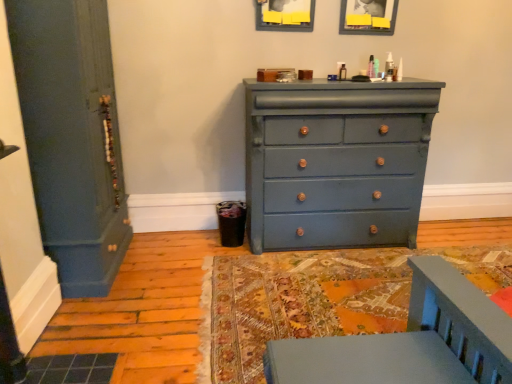
Question: Does matte blue door at left have a smaller size compared to matte gray picture frame at upper center, positioned as the second picture frame in right-to-left order?

Choices:
 (A) yes
 (B) no

Answer: (B)

Question: Is matte blue door at left at the right side of matte gray picture frame at upper center, positioned as the second picture frame in right-to-left order?

Choices:
 (A) no
 (B) yes

Answer: (A)

Question: Considering the relative sizes of matte blue door at left and matte gray picture frame at upper center, positioned as the second picture frame in right-to-left order, in the image provided, is matte blue door at left bigger than matte gray picture frame at upper center, positioned as the second picture frame in right-to-left order,?

Choices:
 (A) no
 (B) yes

Answer: (B)

Question: From the image's perspective, would you say matte blue door at left is shown under matte gray picture frame at upper center, positioned as the second picture frame in right-to-left order?

Choices:
 (A) yes
 (B) no

Answer: (A)

Question: Does matte blue door at left have a greater width compared to matte gray picture frame at upper center, acting as the first picture frame starting from the left?

Choices:
 (A) yes
 (B) no

Answer: (A)

Question: Is matte blue door at left shorter than matte gray picture frame at upper center, acting as the first picture frame starting from the left?

Choices:
 (A) yes
 (B) no

Answer: (B)

Question: Does matte blue door at left have a smaller size compared to matte blue dresser at center?

Choices:
 (A) no
 (B) yes

Answer: (A)

Question: Considering the relative sizes of matte blue door at left and matte blue dresser at center in the image provided, is matte blue door at left shorter than matte blue dresser at center?

Choices:
 (A) yes
 (B) no

Answer: (B)

Question: From the image's perspective, would you say matte blue door at left is shown under matte blue dresser at center?

Choices:
 (A) yes
 (B) no

Answer: (B)

Question: From the image's perspective, is matte blue door at left on matte blue dresser at center?

Choices:
 (A) no
 (B) yes

Answer: (B)

Question: Is matte blue door at left looking in the opposite direction of matte blue dresser at center?

Choices:
 (A) yes
 (B) no

Answer: (B)

Question: Can you confirm if matte blue door at left is thinner than matte blue dresser at center?

Choices:
 (A) yes
 (B) no

Answer: (B)

Question: From a real-world perspective, is matte wooden picture frame at upper center, positioned as the second picture frame in left-to-right order, over matte blue door at left?

Choices:
 (A) no
 (B) yes

Answer: (B)